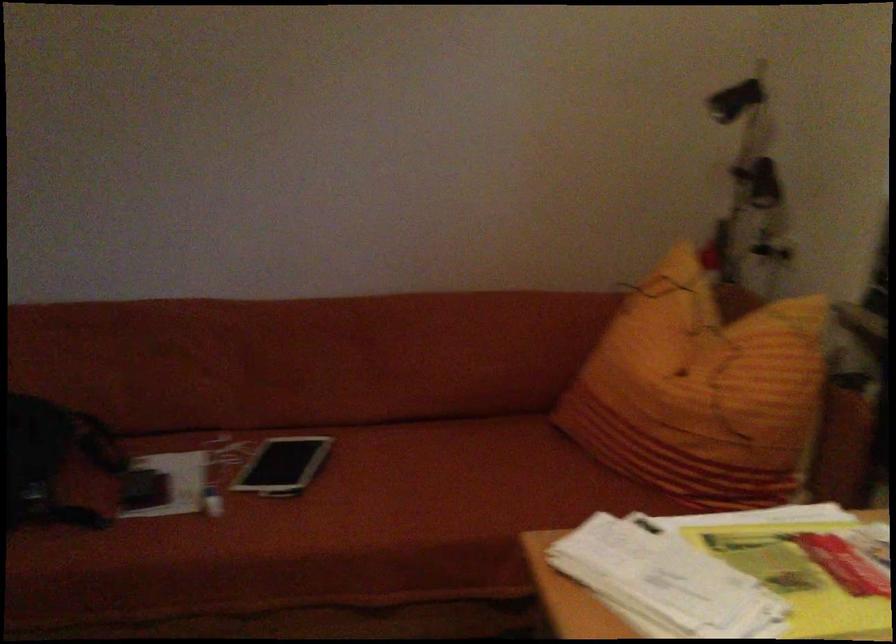
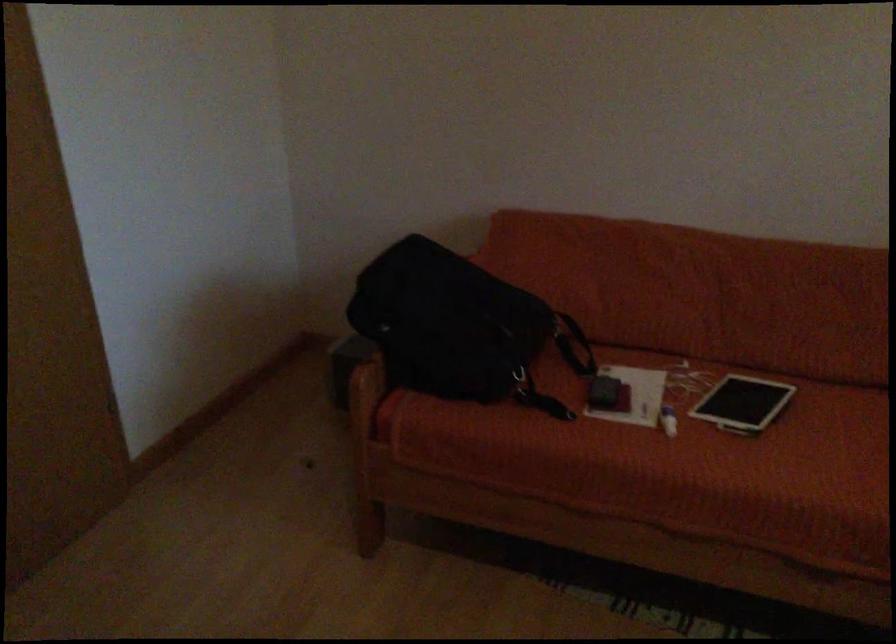
Question: The camera is either moving clockwise (left) or counter-clockwise (right) around the object. The first image is from the beginning of the video and the second image is from the end. Is the camera moving left or right when shooting the video?

Choices:
 (A) Left
 (B) Right

Answer: (B)